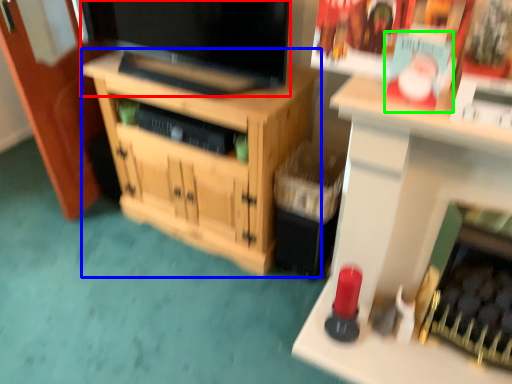
Question: Estimate the real-world distances between objects in this image. Which object is farther from television (highlighted by a red box), cabinetry (highlighted by a blue box) or magazine (highlighted by a green box)?

Choices:
 (A) cabinetry
 (B) magazine

Answer: (B)